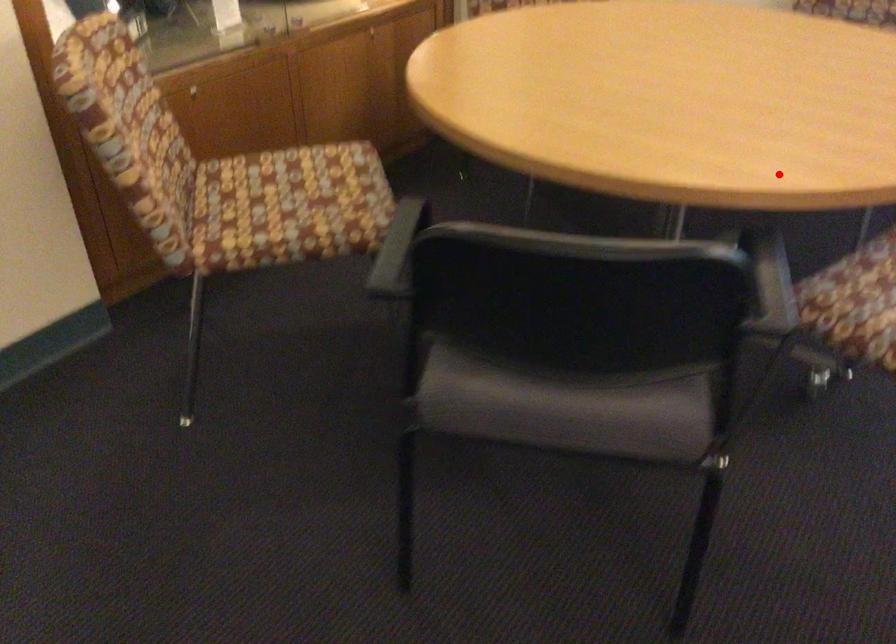
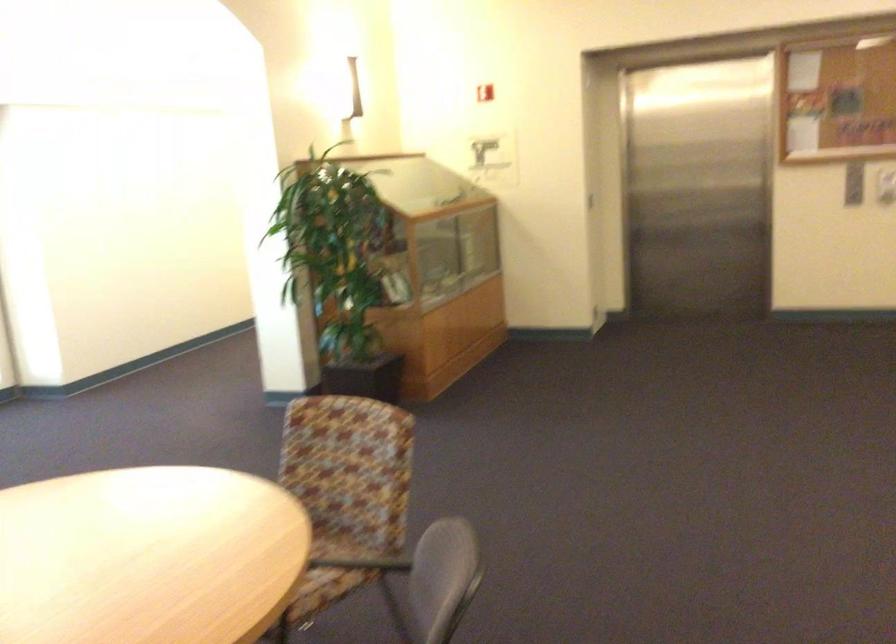
Find the pixel in the second image that matches the highlighted location in the first image.

(288, 535)